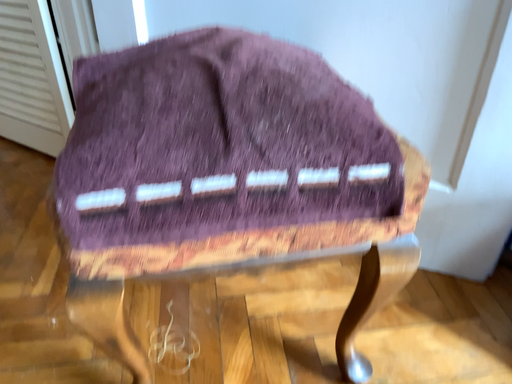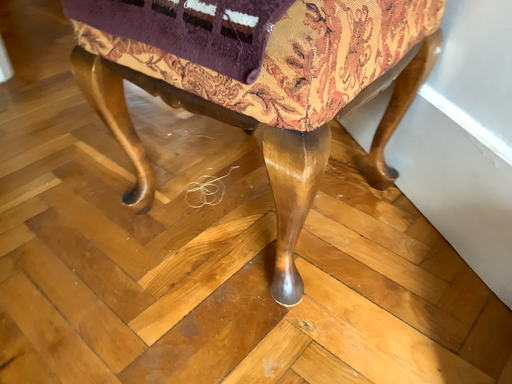
Question: How did the camera likely rotate when shooting the video?

Choices:
 (A) rotated downward
 (B) rotated upward

Answer: (B)